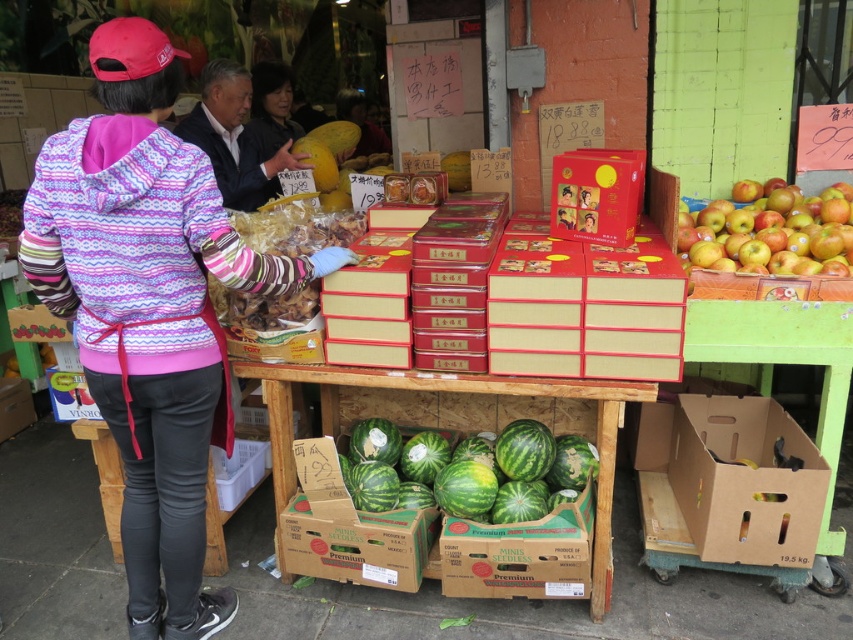
You are a customer at the market looking to buy a watermelon. You see the green textured watermelons at center and the green cardboard box at lower center. Which item is closer to you?

The green textured watermelons at center are closer to you than the green cardboard box at lower center because the green cardboard box at lower center is behind the green textured watermelons at center.

You are a customer at the market and want to know if the brown cardboard boxes at center can fit over the green striped watermelon at center. Can they?

The brown cardboard boxes at center is taller than green striped watermelon at center, so yes, the brown cardboard boxes at center can fit over the green striped watermelon at center because it is taller.

You are a customer at the market and want to locate the green textured watermelons at center. According to the map coordinates provided, where exactly are they positioned?

The green textured watermelons at center are located at the 2D coordinates point (x=469, y=470).